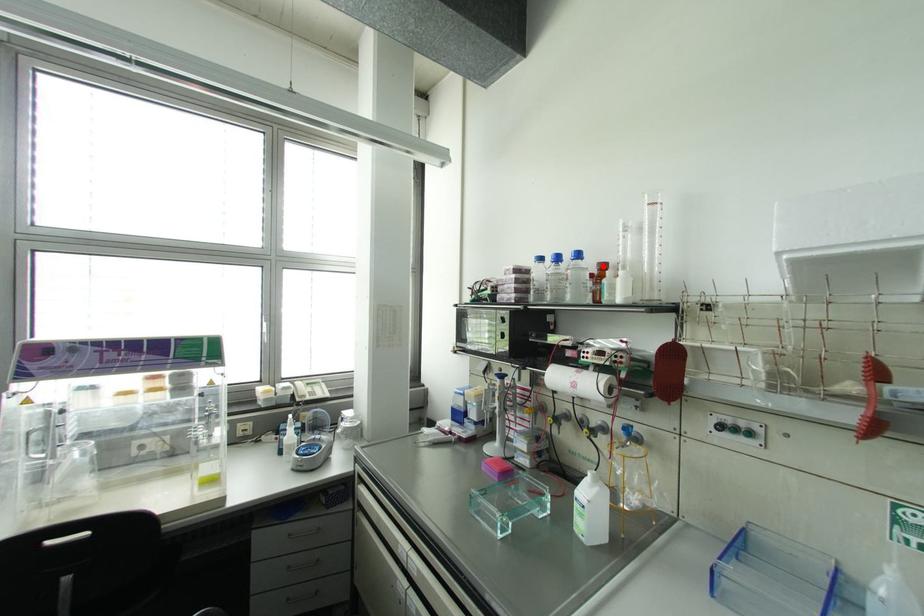
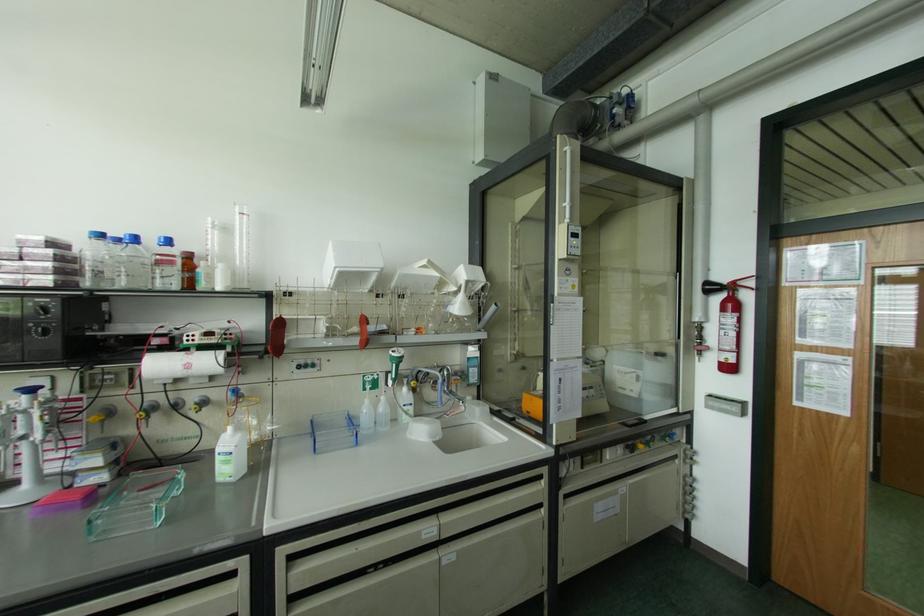
Find the pixel in the second image that matches the highlighted location in the first image.

(188, 256)